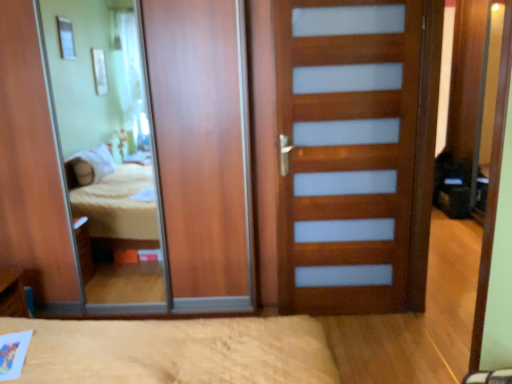
Question: In terms of width, does wooden door with frosted panels at center look wider or thinner when compared to wooden mirror at center?

Choices:
 (A) wide
 (B) thin

Answer: (A)

Question: From the image's perspective, is wooden door with frosted panels at center located above or below wooden mirror at center?

Choices:
 (A) above
 (B) below

Answer: (B)

Question: Which is farther from the wooden door with frosted panels at center?

Choices:
 (A) blue plastic pen at lower left
 (B) wooden mirror at center

Answer: (A)

Question: Which object is the farthest from the wooden door with frosted panels at center?

Choices:
 (A) blue plastic pen at lower left
 (B) wooden mirror at center

Answer: (A)